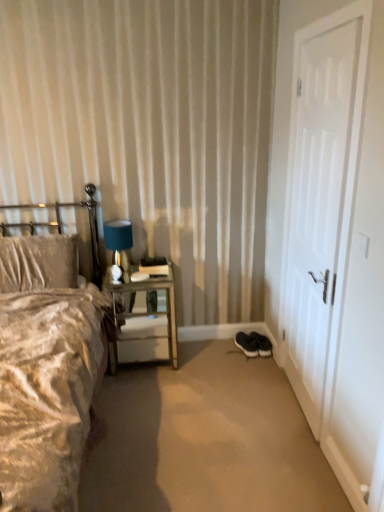
Find the location of a particular element. free space between white matte door at right and metallic silver nightstand at left is located at coordinates (220, 387).